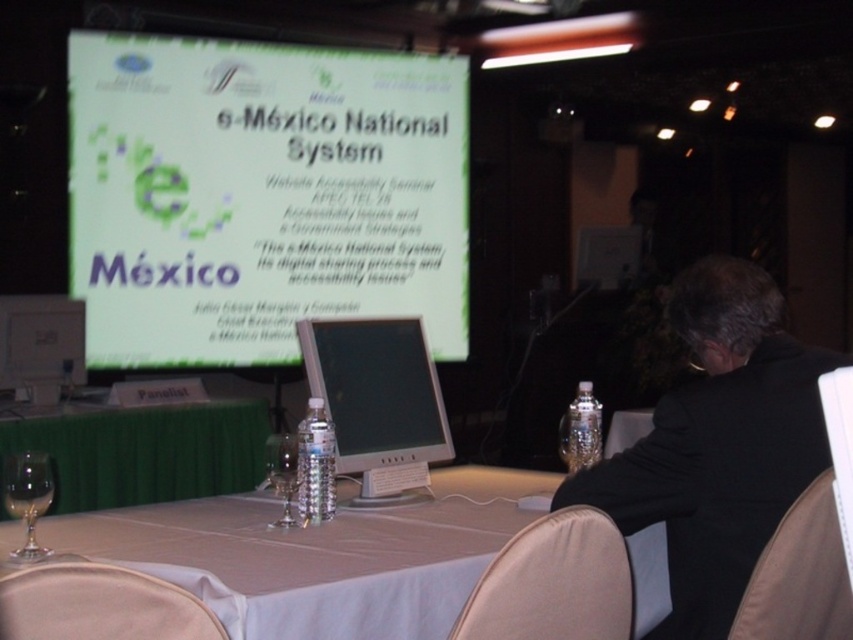
You are attending a tech accessibility conference and notice a speaker wearing a black suit at right. If you want to approach them after their presentation, which direction should you walk relative to your current position facing the large screen?

The black suit at right is located at point 0.695 on the x and 0.843 on the y axis. Since you are facing the large screen, which is in the background, you should walk to your right to reach the speaker wearing the black suit at right.